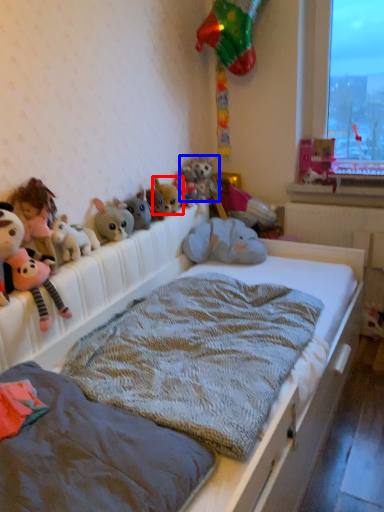
Question: Which object appears farthest to the camera in this image, toy (highlighted by a red box) or animal (highlighted by a blue box)?

Choices:
 (A) toy
 (B) animal

Answer: (B)